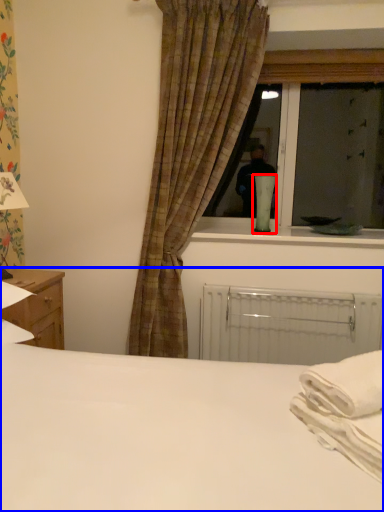
Question: Which of the following is the farthest to the observer, table lamp (highlighted by a red box) or bed (highlighted by a blue box)?

Choices:
 (A) table lamp
 (B) bed

Answer: (A)